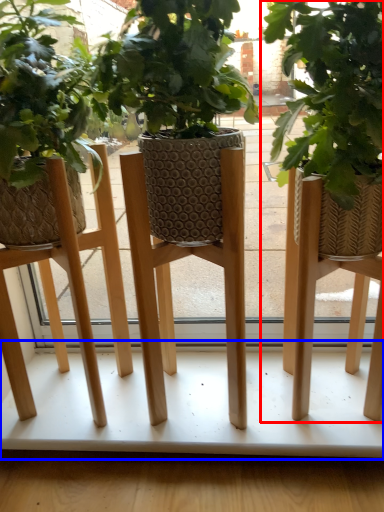
Question: Which of the following is the farthest to the observer, houseplant (highlighted by a red box) or table (highlighted by a blue box)?

Choices:
 (A) houseplant
 (B) table

Answer: (B)